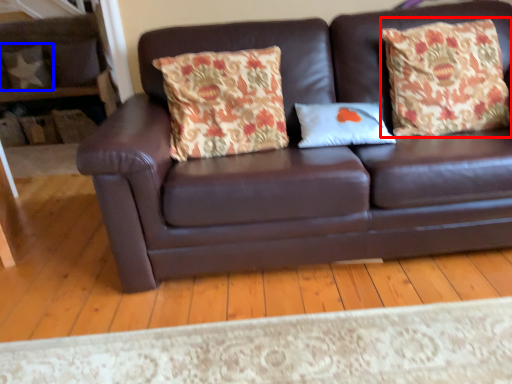
Question: Which object appears closest to the camera in this image, throw pillow (highlighted by a red box) or pillow (highlighted by a blue box)?

Choices:
 (A) throw pillow
 (B) pillow

Answer: (A)